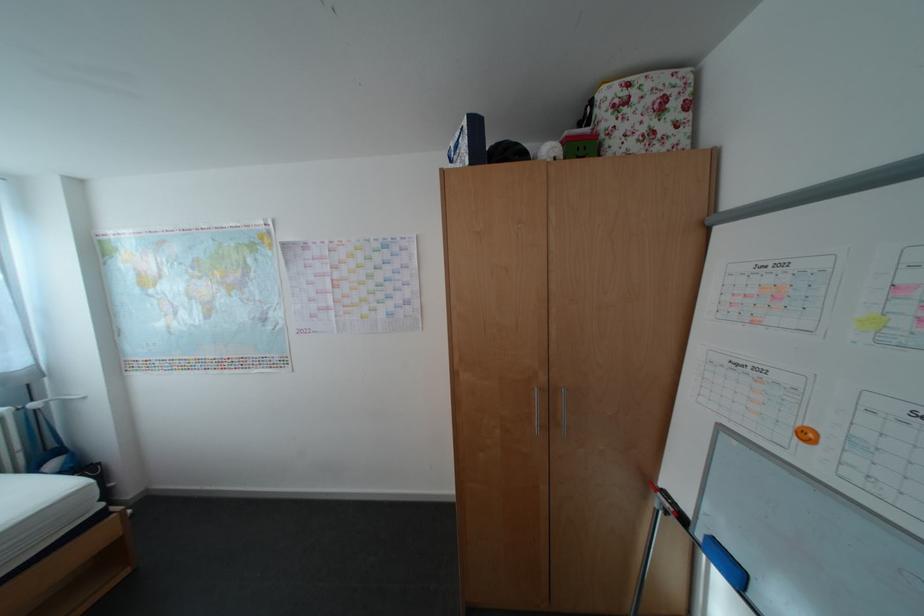
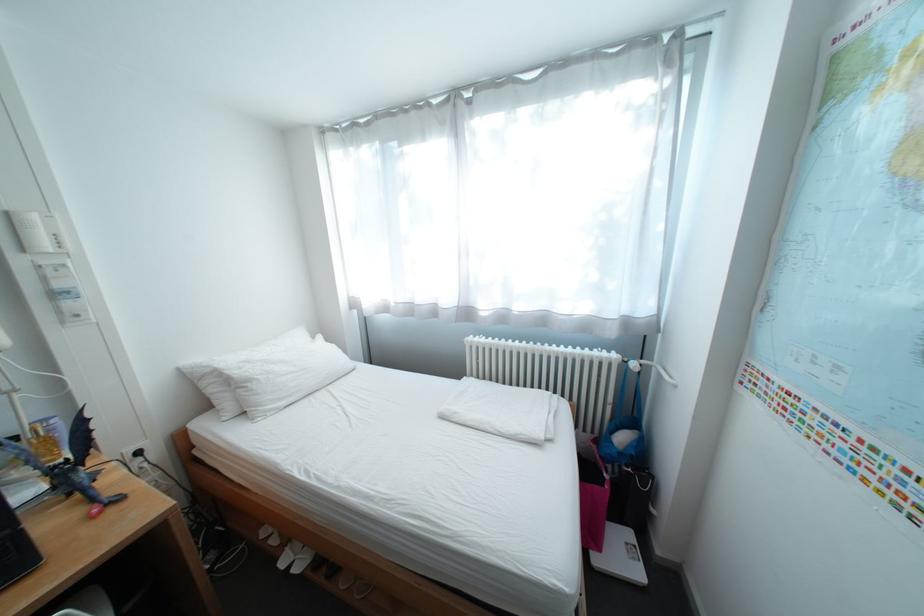
Find the pixel in the second image that matches (30,410) in the first image.

(637, 362)